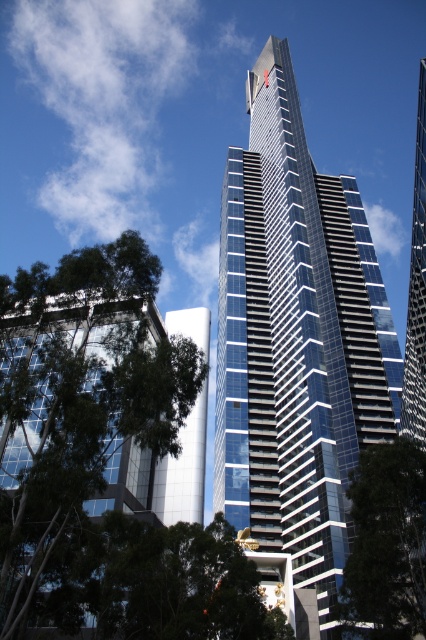
Question: Is glassy blue skyscraper at center bigger than green leafy tree at lower left?

Choices:
 (A) no
 (B) yes

Answer: (B)

Question: Which of the following is the farthest from the observer?

Choices:
 (A) green leafy tree at lower right
 (B) green leafy tree at lower left
 (C) glassy blue skyscraper at center

Answer: (C)

Question: Can you confirm if glassy blue skyscraper at center is smaller than green leafy tree at lower right?

Choices:
 (A) no
 (B) yes

Answer: (A)

Question: Observing the image, what is the correct spatial positioning of green leafy tree at lower left in reference to green leafy tree at lower right?

Choices:
 (A) below
 (B) above

Answer: (B)

Question: Which point is farther to the camera?

Choices:
 (A) glassy blue skyscraper at center
 (B) green leafy tree at lower right
 (C) green leafy tree at lower left

Answer: (A)

Question: Which of these objects is positioned closest to the green leafy tree at lower left?

Choices:
 (A) glassy blue skyscraper at center
 (B) green leafy tree at lower right

Answer: (B)